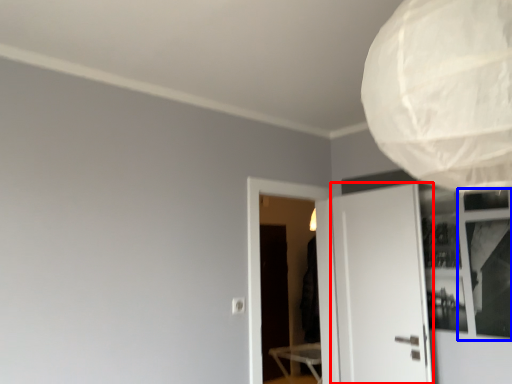
Question: Among these objects, which one is farthest to the camera, door (highlighted by a red box) or window (highlighted by a blue box)?

Choices:
 (A) door
 (B) window

Answer: (A)